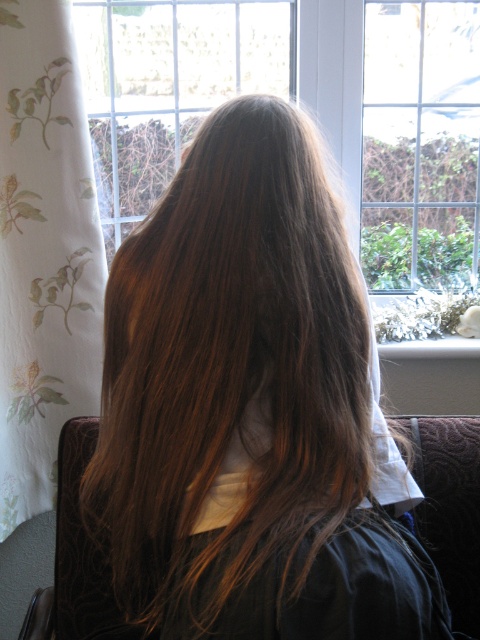
Does brown silky hair at center have a lesser height compared to floral-patterned fabric at left?

Correct, brown silky hair at center is not as tall as floral-patterned fabric at left.

Is brown silky hair at center positioned at the back of floral-patterned fabric at left?

That is False.

Is point (376, 556) positioned in front of point (54, 83)?

Yes.

Where is `brown silky hair at center`? Image resolution: width=480 pixels, height=640 pixels. brown silky hair at center is located at coordinates (248, 406).

Does clear glass window at upper center have a lesser height compared to velvet brown chair at center?

In fact, clear glass window at upper center may be taller than velvet brown chair at center.

Is clear glass window at upper center smaller than velvet brown chair at center?

No.

Is point (111, 70) more distant than point (463, 512)?

Yes, it is.

You are a GUI agent. You are given a task and a screenshot of the screen. Output one action in this format:
    pyautogui.click(x=<x>, y=<y>)
    Task: Click on the clear glass window at upper center
    The height and width of the screenshot is (640, 480).
    Given the screenshot: What is the action you would take?
    pyautogui.click(x=420, y=163)

Which is in front, point (25, 156) or point (100, 582)?

Point (100, 582) is in front.

Does point (31, 278) lie in front of point (84, 637)?

No, (31, 278) is further to viewer.

The height and width of the screenshot is (640, 480). What are the coordinates of `floral-patterned fabric at left` in the screenshot? It's located at (44, 253).